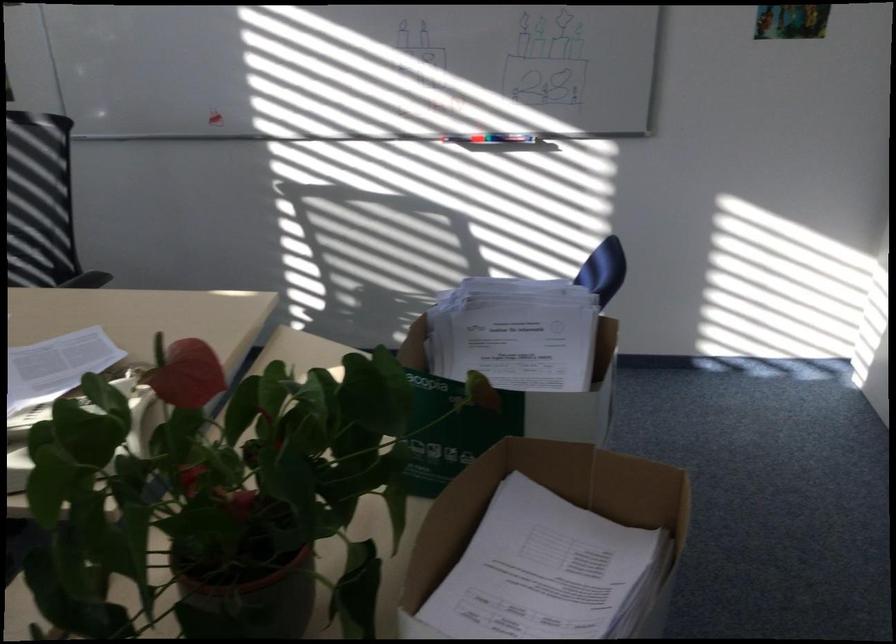
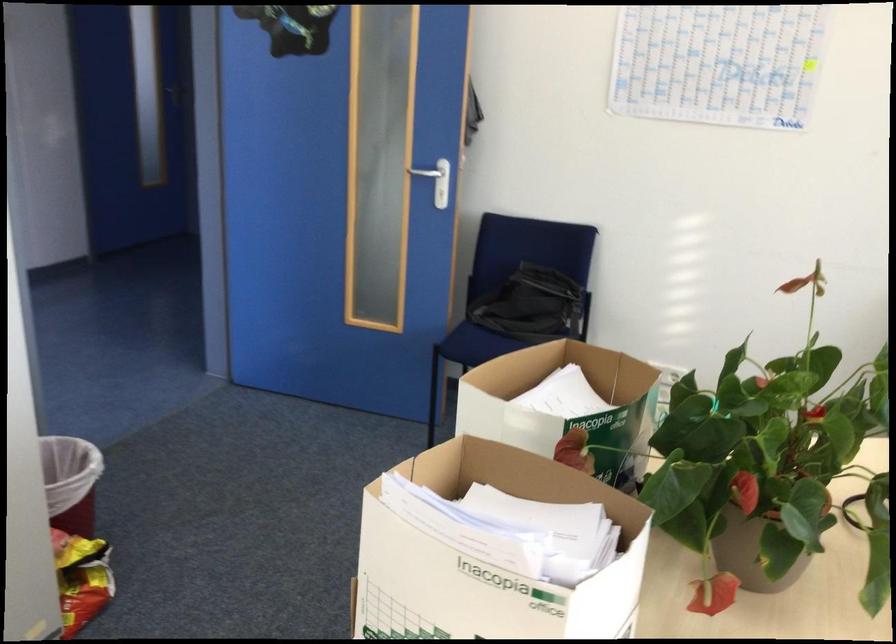
The point at (x=428, y=325) is marked in the first image. Where is the corresponding point in the second image?

(489, 558)